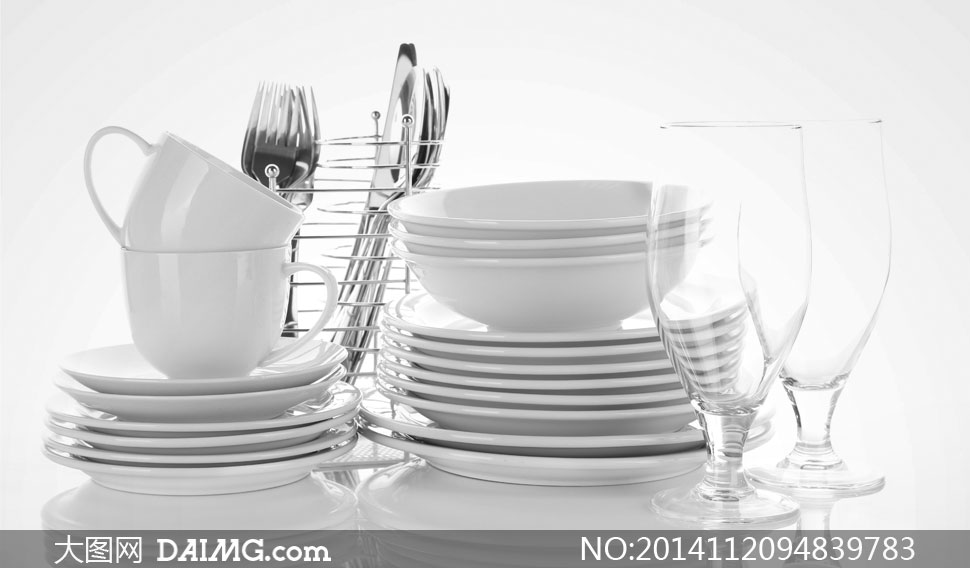
Where is `cups`? Image resolution: width=970 pixels, height=568 pixels. cups is located at coordinates (190, 198), (725, 264), (850, 260), (216, 323).